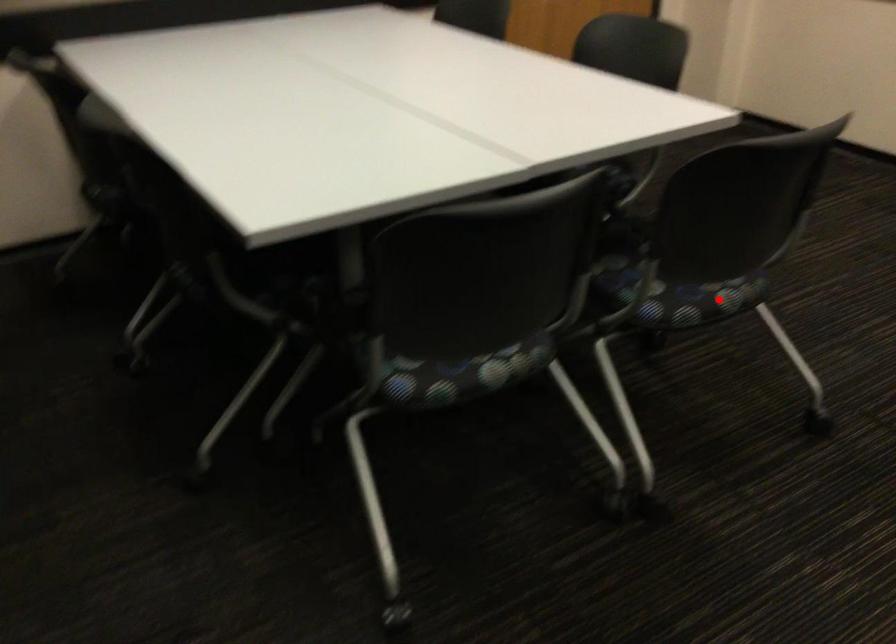
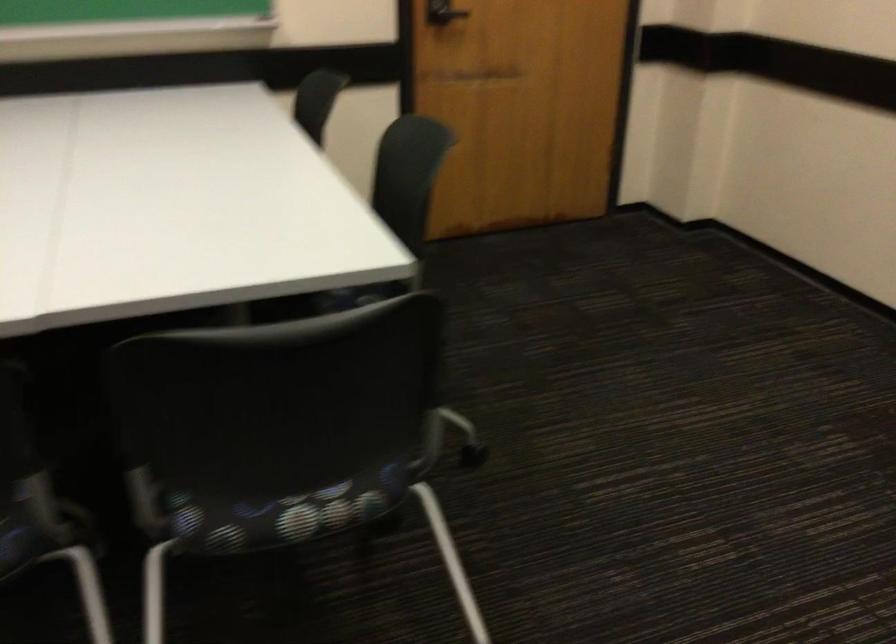
Question: I am providing you with two images of the same scene from different viewpoints. Given a red point in image1, look at the same physical point in image2. Is it:

Choices:
 (A) Closer to the viewpoint
 (B) Farther from the viewpoint

Answer: (A)